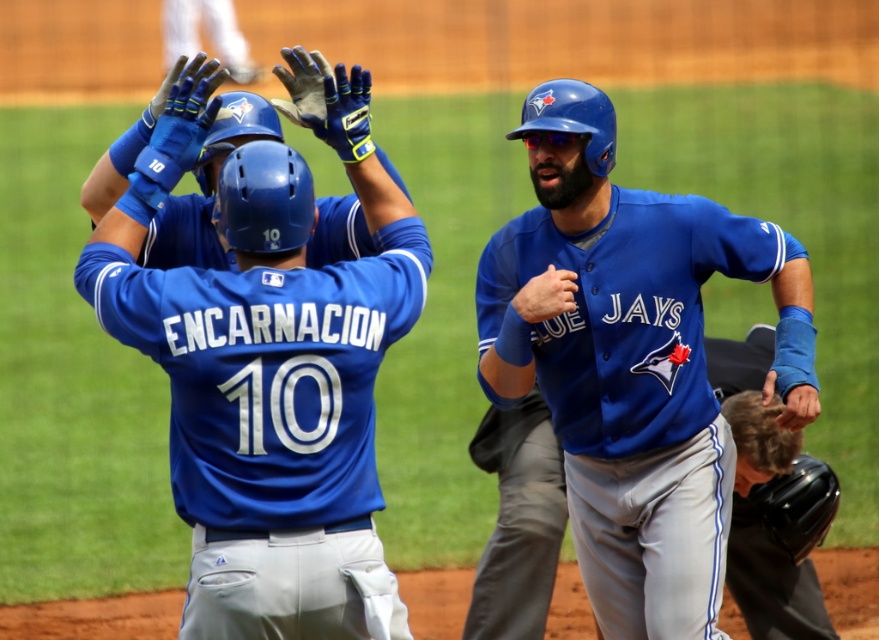
You are a photographer at the baseball game and want to capture a photo of the matte blue helmet at upper center and the blue jersey at center. Which object should you focus on first if you want to ensure both are in focus?

The matte blue helmet at upper center is above the blue jersey at center, so you should focus on the blue jersey at center first since it is closer to the camera and then adjust for the matte blue helmet at upper center to ensure both are in focus.

You are a photographer at the baseball game and want to capture a photo of both the matte blue helmet at upper center and the blue jersey at center. Which object should you zoom in on first to ensure both are in focus?

The matte blue helmet at upper center is not as tall as the blue jersey at center, so you should zoom in on the blue jersey at center first to ensure both are in focus.

You are a photographer trying to capture a closeup of the matte blue helmet at upper center and the blue jersey at center. Which object should you focus on first to ensure it appears sharp in the photo?

The matte blue helmet at upper center is closer to the viewer than the blue jersey at center, so you should focus on the matte blue helmet at upper center first to ensure it appears sharp.